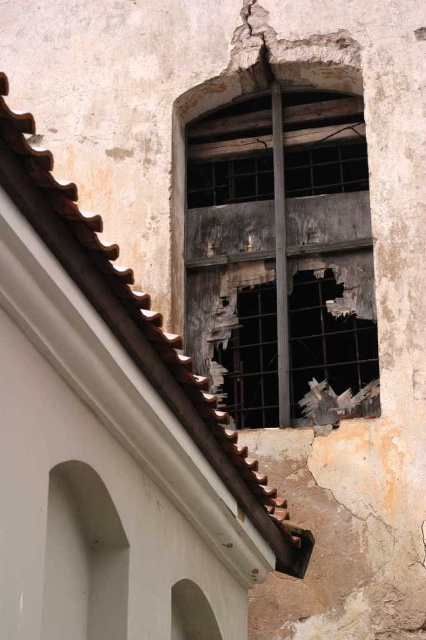
Is the position of rusty metal window at upper center less distant than that of rusty metal window at center?

Yes, rusty metal window at upper center is in front of rusty metal window at center.

Can you confirm if rusty metal window at upper center is bigger than rusty metal window at center?

Yes, rusty metal window at upper center is bigger than rusty metal window at center.

Locate an element on the screen. The image size is (426, 640). rusty metal window at upper center is located at coordinates (281, 253).

Is rusty metal window at upper center positioned at the back of smooth brown stone arch at lower left?

Yes.

Does point (284, 326) come farther from viewer compared to point (193, 595)?

Yes, it is.

Locate an element on the screen. The image size is (426, 640). rusty metal window at upper center is located at coordinates (281, 253).

Does rusty metal window at center appear on the right side of smooth brown stone arch at lower left?

Yes, rusty metal window at center is to the right of smooth brown stone arch at lower left.

Between point (307, 298) and point (180, 602), which one is positioned in front?

Point (180, 602) is in front.

This screenshot has width=426, height=640. Describe the element at coordinates (325, 340) in the screenshot. I see `rusty metal window at center` at that location.

Where is `rusty metal window at center`? rusty metal window at center is located at coordinates (325, 340).